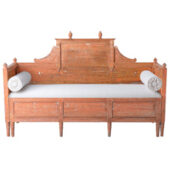
Where is `bench leg 2`? bench leg 2 is located at coordinates (12, 129).